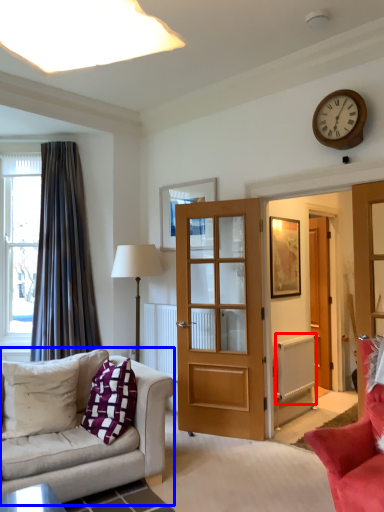
Question: Which object appears closest to the camera in this image, radiator (highlighted by a red box) or studio couch (highlighted by a blue box)?

Choices:
 (A) radiator
 (B) studio couch

Answer: (B)